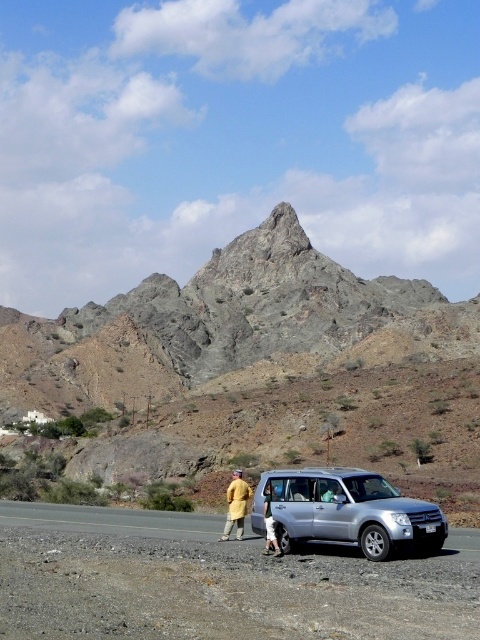
Question: Which point is farther to the camera?

Choices:
 (A) (241, 490)
 (B) (265, 497)
 (C) (384, 492)

Answer: (A)

Question: Where is silver metallic suv at center located in relation to yellow fabric coat at center in the image?

Choices:
 (A) left
 (B) right

Answer: (B)

Question: Which is nearer to the light brown leather jacket at lower center?

Choices:
 (A) yellow fabric coat at center
 (B) gray rocky mountain at upper center

Answer: (A)

Question: Which point is closer to the camera?

Choices:
 (A) gray rocky mountain at upper center
 (B) silver metallic suv at center

Answer: (B)

Question: Is yellow fabric coat at center wider than light brown leather jacket at lower center?

Choices:
 (A) no
 (B) yes

Answer: (B)

Question: Is silver metallic suv at center wider than light brown leather jacket at lower center?

Choices:
 (A) no
 (B) yes

Answer: (B)